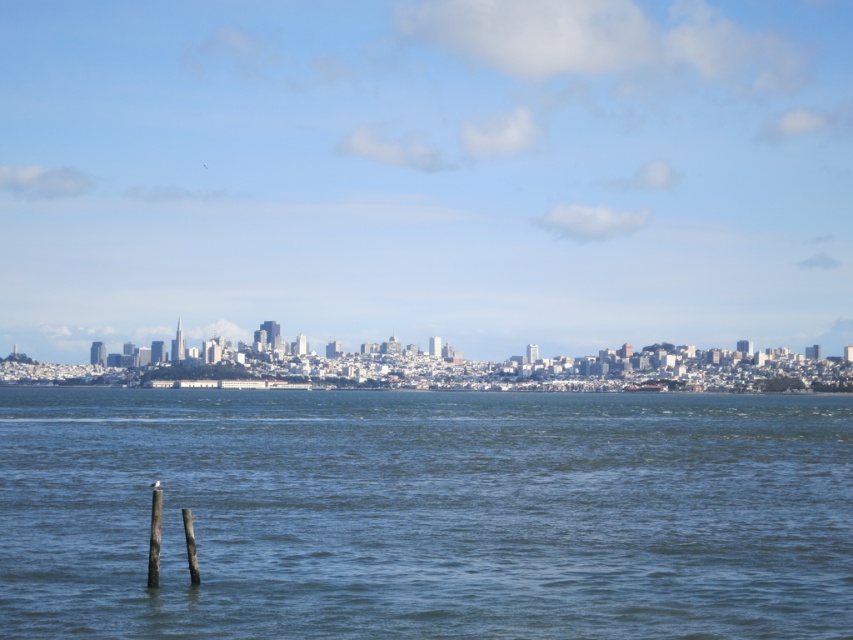
You are standing on the wooden post at lower left and want to see the metallic gray ship at center. In which direction should you look to see the ship?

You should look to the right because the wooden post at lower left is positioned on the left side of the metallic gray ship at center.

You are standing on a pier and notice the blue water at center and the metallic gray ship at center. Which object is positioned to the right from your viewpoint?

The metallic gray ship at center is positioned to the right of the blue water at center.

You are a photographer trying to capture the city skyline. You notice the wooden post at lower left and the metallic gray ship at center in your frame. Which object appears narrower in the photo?

The wooden post at lower left appears narrower than the metallic gray ship at center because it has a lesser width compared to the ship.